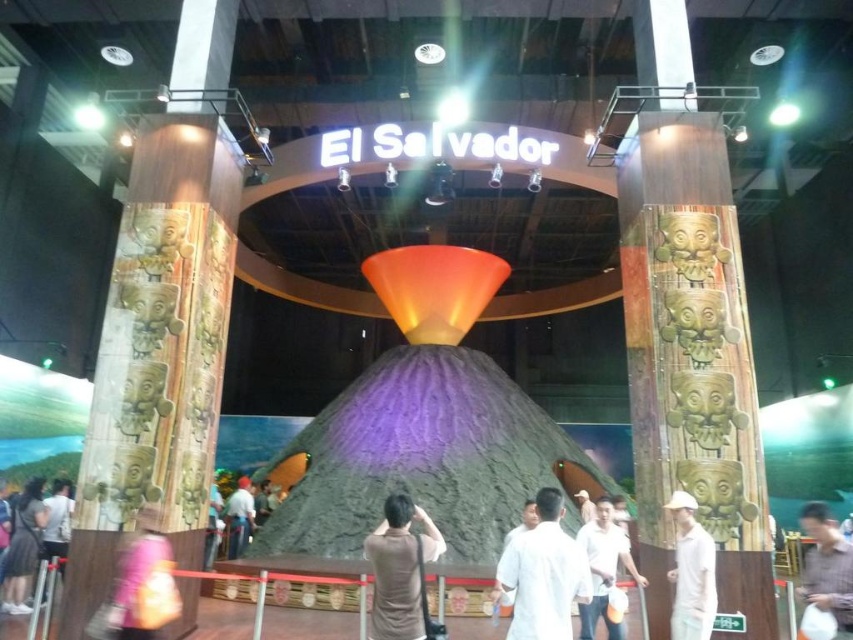
From the picture: You are an event organizer who needs to place a small decorative item on the exhibit table. The item requires a space wider than the brown shirt at center. Can the pink fabric bag at lower left provide enough space for it?

The pink fabric bag at lower left has a larger width than the brown shirt at center, so it can provide enough space for the small decorative item that requires a width larger than the brown shirt at center.

You are at an El Salvador exhibit and want to pick up both the pink fabric bag at lower left and the white shirt at center. Which item should you move towards first if you are standing at the entrance of the exhibit?

The pink fabric bag at lower left is to the right of the white shirt at center. Since you are at the entrance, you should move towards the white shirt at center first because it is closer to your starting position.

You are a fashion designer visiting the El Salvador exhibit. You notice the white cotton shirt at center and the matte gray shirt at lower left. Which shirt would require more fabric to produce, based on their sizes?

The matte gray shirt at lower left requires more fabric to produce because it is larger than the white cotton shirt at center.